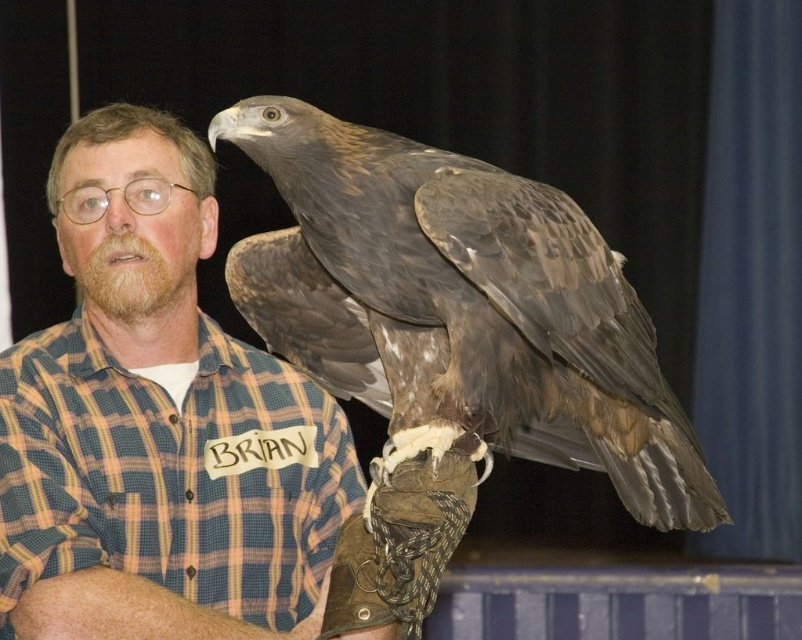
Is plaid shirt at center thinner than plaid cotton shirt at center?

In fact, plaid shirt at center might be wider than plaid cotton shirt at center.

Between plaid shirt at center and plaid cotton shirt at center, which one appears on the right side from the viewer's perspective?

From the viewer's perspective, plaid shirt at center appears more on the right side.

Measure the distance between plaid shirt at center and camera.

plaid shirt at center is 2.25 meters away from camera.

Where is `plaid shirt at center`? plaid shirt at center is located at coordinates (161, 428).

Does plaid shirt at center have a greater width compared to brown feathered falcon at upper right?

No, plaid shirt at center is not wider than brown feathered falcon at upper right.

Is plaid shirt at center positioned in front of brown feathered falcon at upper right?

No, plaid shirt at center is further to the viewer.

Does point (90, 225) come in front of point (512, 353)?

No, (90, 225) is behind (512, 353).

Image resolution: width=802 pixels, height=640 pixels. In order to click on plaid shirt at center in this screenshot , I will do [161, 428].

What do you see at coordinates (460, 308) in the screenshot? The width and height of the screenshot is (802, 640). I see `brown feathered falcon at upper right` at bounding box center [460, 308].

Does brown feathered falcon at upper right have a greater width compared to plaid cotton shirt at center?

Indeed, brown feathered falcon at upper right has a greater width compared to plaid cotton shirt at center.

Locate an element on the screen. This screenshot has height=640, width=802. brown feathered falcon at upper right is located at coordinates (460, 308).